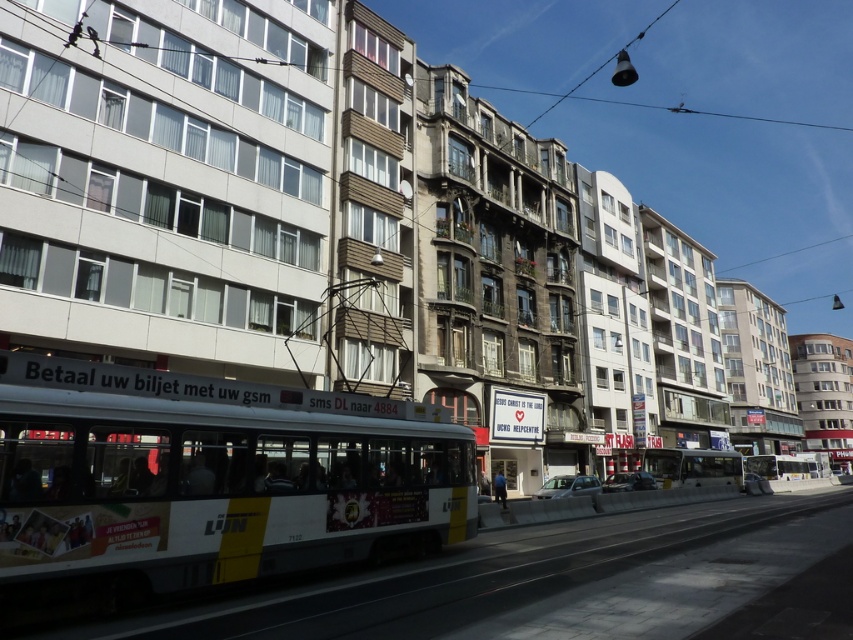
You are standing at the tram tracks and want to walk to the white glossy bus at center. Which direction should you go? Please answer with a single word like north, south, east, west, left, right, forward, backward, etc.

The white glossy bus at center is located at coordinates point (209, 480), so you should go forward to reach it.

You are a pedestrian standing on the sidewalk to the right of the tram. You see a white glossy bus at center and a white metallic bus at center. Which bus is closer to the tram tracks?

The white glossy bus at center is positioned on the left side of the white metallic bus at center, so it is closer to the tram tracks since it is on the left side of the other bus.

You are a city planner analyzing the layout of this urban street. You notice both the white glossy bus at center and the yellow metallic bus at center. Which one would require a narrower lane to accommodate its width?

The white glossy bus at center occupies less space than the yellow metallic bus at center, so it would require a narrower lane to accommodate its width.